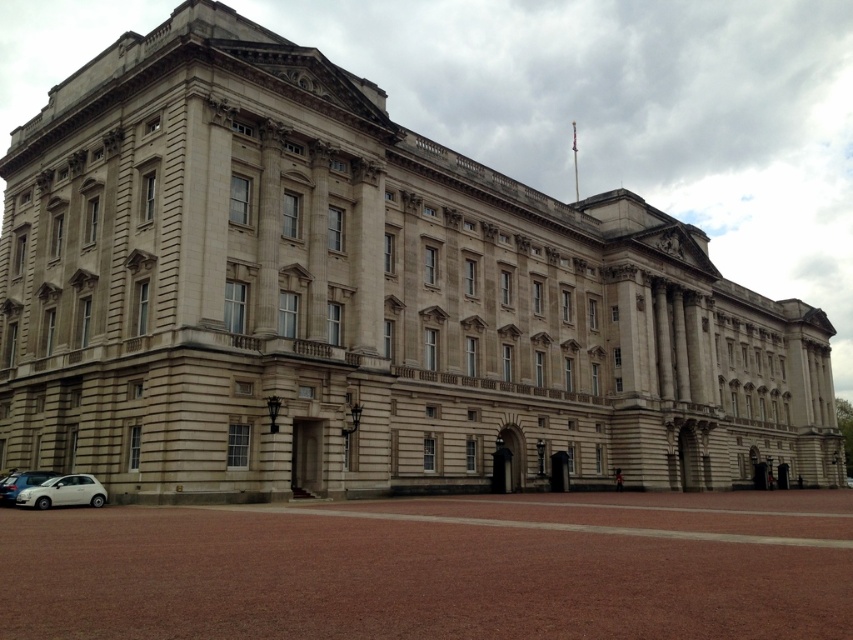
Is white matte car at lower left shorter than silver metallic car at lower left?

Yes.

Is white matte car at lower left wider than silver metallic car at lower left?

No, white matte car at lower left is not wider than silver metallic car at lower left.

Is point (90, 484) more distant than point (35, 472)?

No.

Find the location of `white matte car at lower left`. white matte car at lower left is located at coordinates (62, 492).